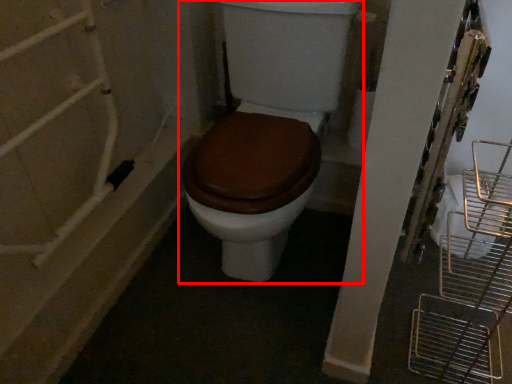
Question: From the image's perspective, where is toilet (annotated by the red box) located relative to bath?

Choices:
 (A) below
 (B) above

Answer: (B)